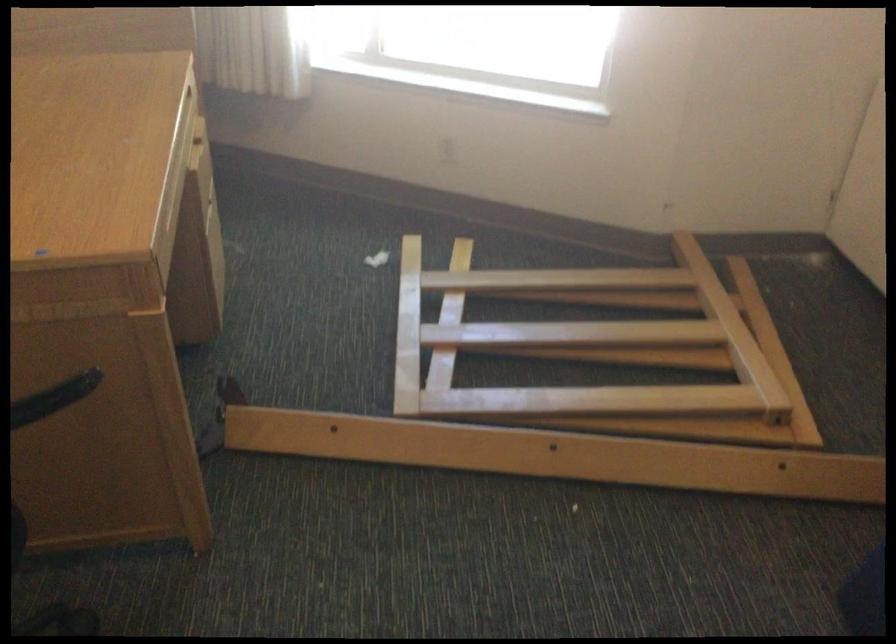
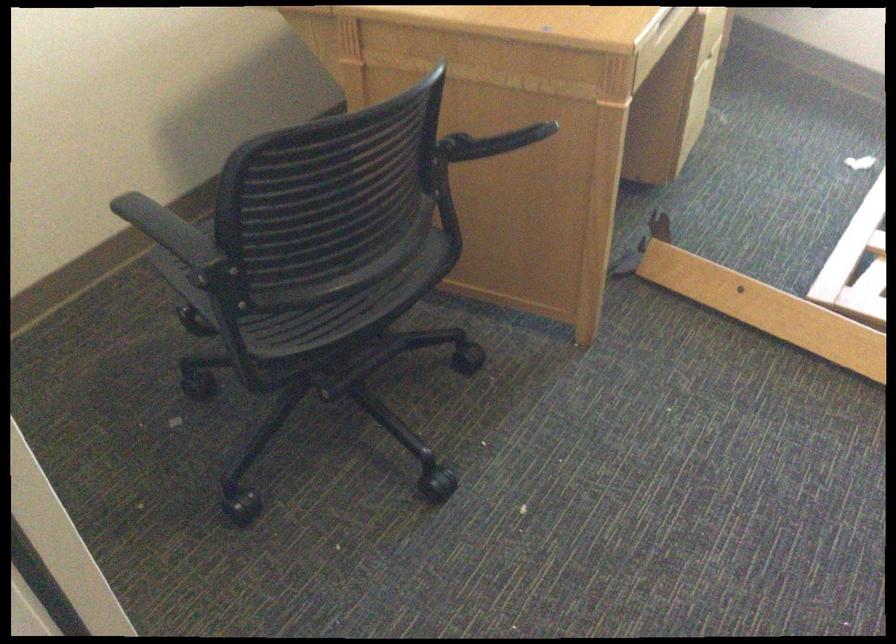
Where in the second image is the point corresponding to pixel 364 431 from the first image?

(767, 308)